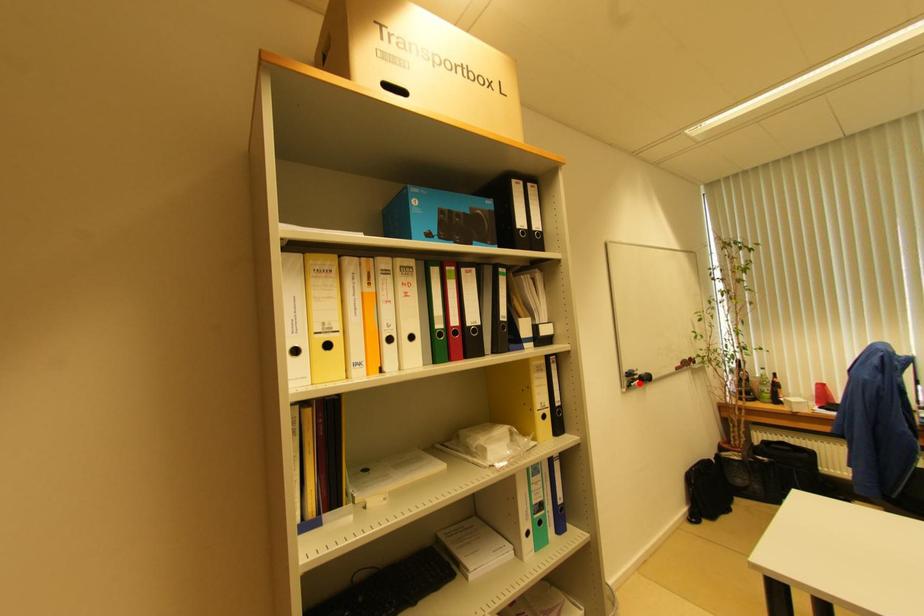
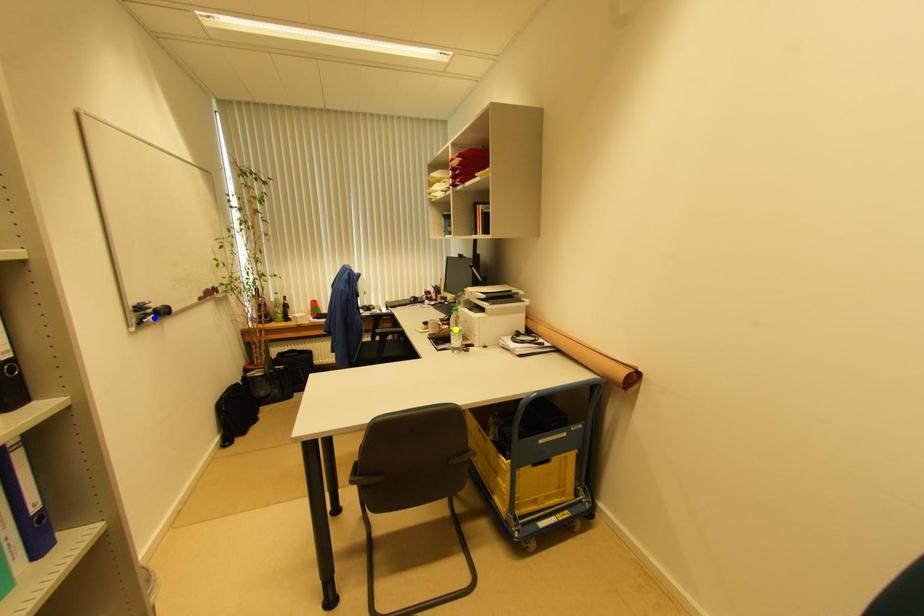
Question: I am providing you with two images of the same scene from different viewpoints. A red point is marked on the first image. You are given multiple points on the second image. Which spot in image 2 lines up with the point in image 1?

Choices:
 (A) green point
 (B) blue point
 (C) yellow point

Answer: (B)